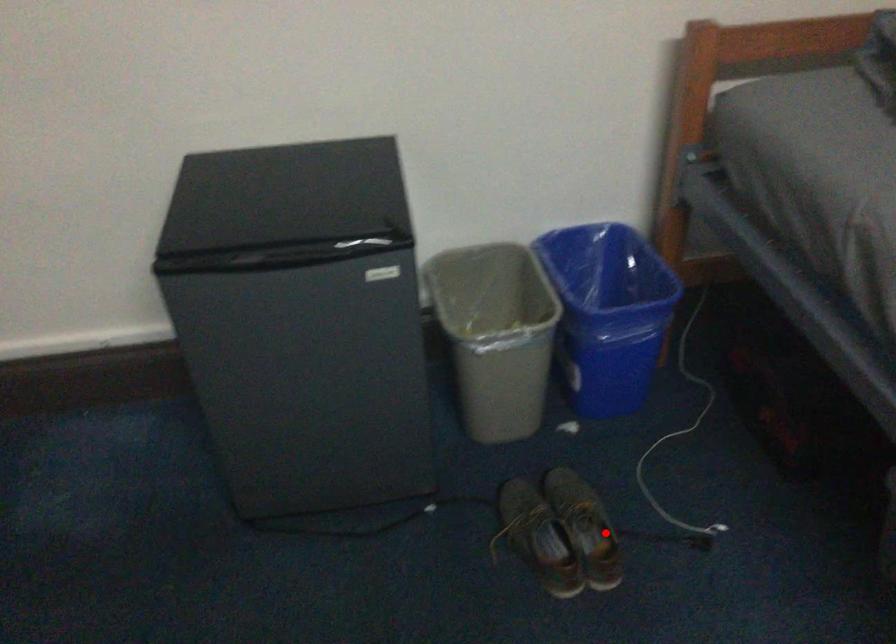
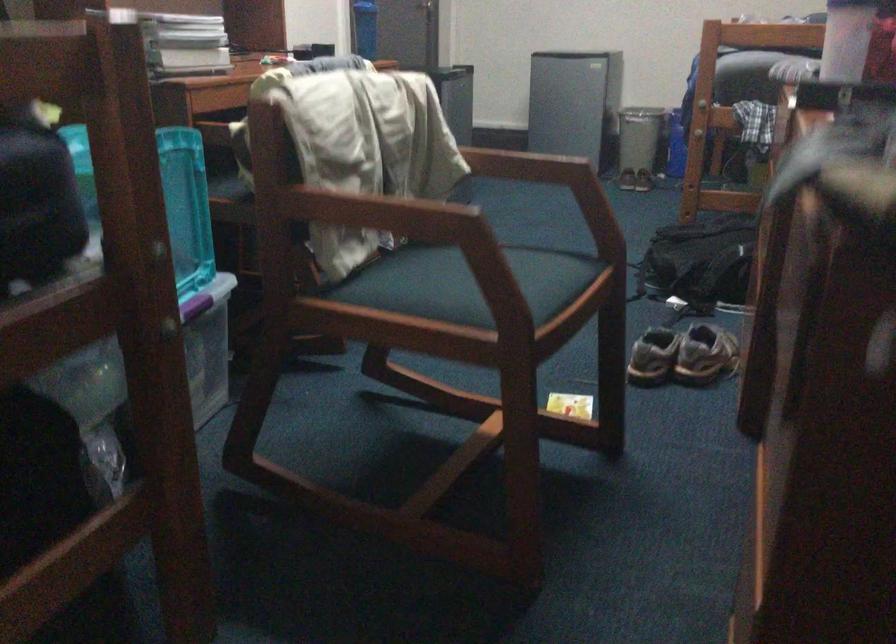
Question: I am providing you with two images of the same scene from different viewpoints. Image1 has a red point marked. In image2, the corresponding 3D location appears at what relative position? Reply with the corresponding letter.

Choices:
 (A) Closer
 (B) Farther

Answer: (B)